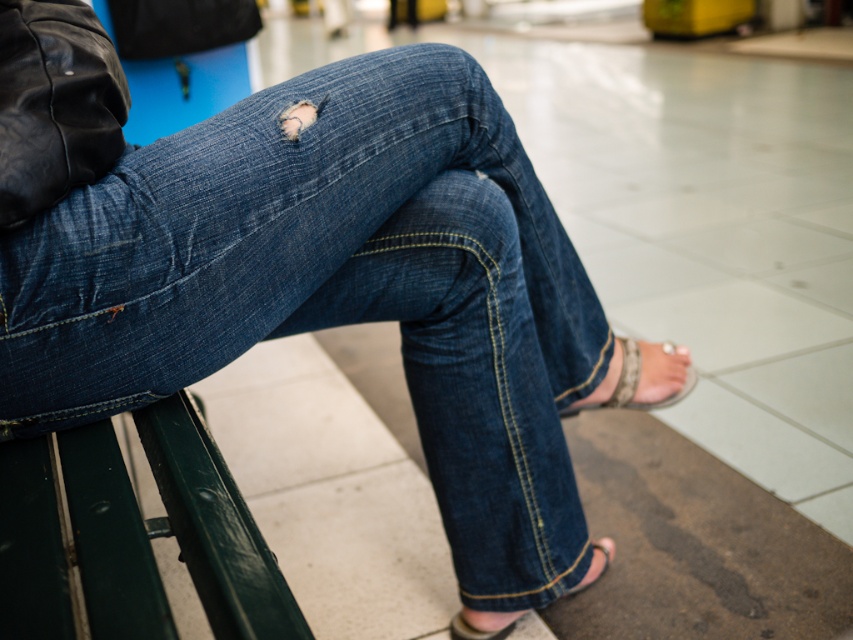
Question: Which point appears closest to the camera in this image?

Choices:
 (A) (693, 372)
 (B) (517, 556)

Answer: (B)

Question: Considering the relative positions of denim at left and leather textured sandal at lower right in the image provided, where is denim at left located with respect to leather textured sandal at lower right?

Choices:
 (A) right
 (B) left

Answer: (B)

Question: Which point is farther to the camera?

Choices:
 (A) leather textured sandal at lower right
 (B) denim at left
 (C) pink fabric sandal at lower right

Answer: (A)

Question: Which of the following is the closest to the observer?

Choices:
 (A) (282, 301)
 (B) (488, 628)
 (C) (659, 394)

Answer: (A)

Question: Is denim at left to the left of pink fabric sandal at lower right from the viewer's perspective?

Choices:
 (A) no
 (B) yes

Answer: (B)

Question: Is leather textured sandal at lower right positioned before pink fabric sandal at lower right?

Choices:
 (A) yes
 (B) no

Answer: (B)